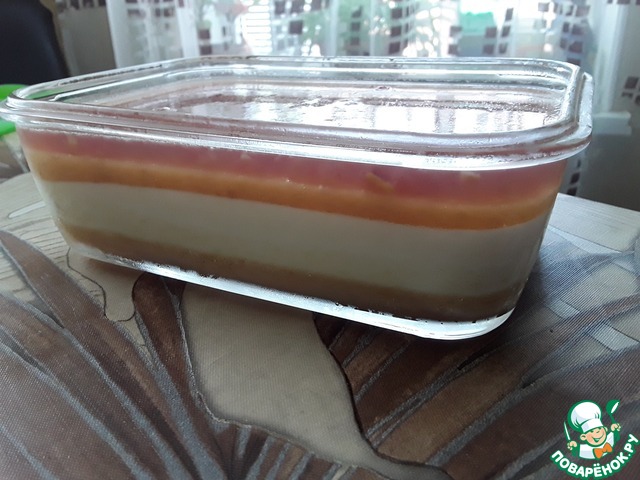
You are a GUI agent. You are given a task and a screenshot of the screen. Output one action in this format:
    pyautogui.click(x=<x>, y=<y>)
    Task: Click on the window sill
    Image resolution: width=640 pixels, height=480 pixels.
    Given the screenshot: What is the action you would take?
    tap(616, 121)